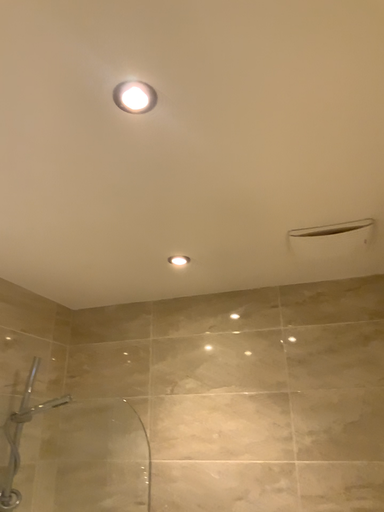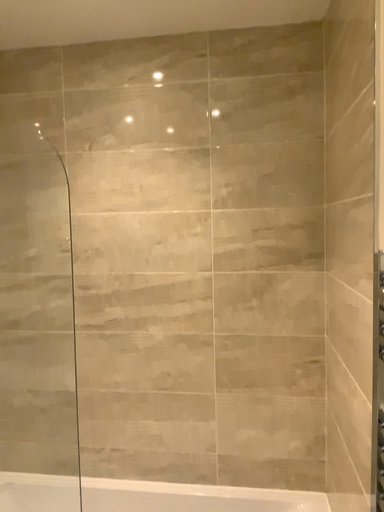
Question: How did the camera likely rotate when shooting the video?

Choices:
 (A) rotated right
 (B) rotated left

Answer: (A)